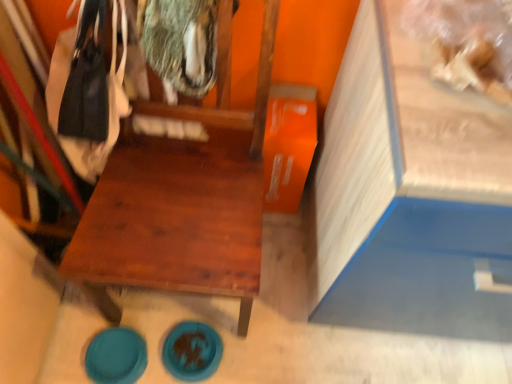
This screenshot has height=384, width=512. Describe the element at coordinates (183, 202) in the screenshot. I see `wooden chair at center` at that location.

The width and height of the screenshot is (512, 384). What are the coordinates of `blue matte plate at lower center, which is counted as the 2th plate, starting from the left` in the screenshot? It's located at click(x=192, y=351).

Can you confirm if blue matte plate at lower center, which is counted as the 2th plate, starting from the left, is positioned to the right of wooden chair at center?

No.

Considering the sizes of objects blue matte plate at lower center, which is counted as the 1th plate, starting from the right, and wooden chair at center in the image provided, who is smaller, blue matte plate at lower center, which is counted as the 1th plate, starting from the right, or wooden chair at center?

With smaller size is blue matte plate at lower center, which is counted as the 1th plate, starting from the right.

Looking at this image, is blue matte plate at lower center, which is counted as the 2th plate, starting from the left, looking in the opposite direction of wooden chair at center?

Yes, blue matte plate at lower center, which is counted as the 2th plate, starting from the left, is positioned with its back facing wooden chair at center.

Could you tell me if wooden chair at center is turned towards teal glossy plate at lower left, which ranks as the 1th plate in left-to-right order?

Yes.

From a real-world perspective, which object stands above the other?

wooden chair at center is physically above.

Based on the photo, is wooden chair at center inside or outside of teal glossy plate at lower left, which ranks as the 1th plate in left-to-right order?

wooden chair at center is not enclosed by teal glossy plate at lower left, which ranks as the 1th plate in left-to-right order.

Is wooden chair at center taller or shorter than teal glossy plate at lower left, which ranks as the 1th plate in left-to-right order?

wooden chair at center is taller than teal glossy plate at lower left, which ranks as the 1th plate in left-to-right order.

From the image's perspective, is teal glossy plate at lower left, marked as the second plate in a right-to-left arrangement, located beneath wooden chair at center?

Yes.

From a real-world perspective, is teal glossy plate at lower left, marked as the second plate in a right-to-left arrangement, physically located above or below wooden chair at center?

Clearly, from a real-world perspective, teal glossy plate at lower left, marked as the second plate in a right-to-left arrangement, is below wooden chair at center.

Is wooden chair at center at the back of teal glossy plate at lower left, marked as the second plate in a right-to-left arrangement?

Yes, teal glossy plate at lower left, marked as the second plate in a right-to-left arrangement, is facing away from wooden chair at center.

Does teal glossy plate at lower left, marked as the second plate in a right-to-left arrangement, have a greater width compared to wooden chair at center?

No, teal glossy plate at lower left, marked as the second plate in a right-to-left arrangement, is not wider than wooden chair at center.

Which object is further away from the camera taking this photo, wooden chair at center or blue matte plate at lower center, which is counted as the 1th plate, starting from the right?

blue matte plate at lower center, which is counted as the 1th plate, starting from the right, is more distant.

Is blue matte plate at lower center, which is counted as the 1th plate, starting from the right, at the back of wooden chair at center?

That's not correct — wooden chair at center is not looking away from blue matte plate at lower center, which is counted as the 1th plate, starting from the right.

Considering the relative sizes of wooden chair at center and blue matte plate at lower center, which is counted as the 1th plate, starting from the right, in the image provided, is wooden chair at center wider than blue matte plate at lower center, which is counted as the 1th plate, starting from the right,?

Indeed, wooden chair at center has a greater width compared to blue matte plate at lower center, which is counted as the 1th plate, starting from the right.

Consider the image. Is teal glossy plate at lower left, marked as the second plate in a right-to-left arrangement, turned away from blue matte plate at lower center, which is counted as the 2th plate, starting from the left?

teal glossy plate at lower left, marked as the second plate in a right-to-left arrangement, is not turned away from blue matte plate at lower center, which is counted as the 2th plate, starting from the left.

Between teal glossy plate at lower left, marked as the second plate in a right-to-left arrangement, and blue matte plate at lower center, which is counted as the 2th plate, starting from the left, which one is positioned in front?

teal glossy plate at lower left, marked as the second plate in a right-to-left arrangement, is in front.

Consider the image. Considering the positions of objects teal glossy plate at lower left, which ranks as the 1th plate in left-to-right order, and blue matte plate at lower center, which is counted as the 2th plate, starting from the left, in the image provided, who is more to the right, teal glossy plate at lower left, which ranks as the 1th plate in left-to-right order, or blue matte plate at lower center, which is counted as the 2th plate, starting from the left,?

blue matte plate at lower center, which is counted as the 2th plate, starting from the left.

Could you tell me if blue matte plate at lower center, which is counted as the 2th plate, starting from the left, is facing teal glossy plate at lower left, which ranks as the 1th plate in left-to-right order?

No.

Considering the relative sizes of blue matte plate at lower center, which is counted as the 2th plate, starting from the left, and teal glossy plate at lower left, marked as the second plate in a right-to-left arrangement, in the image provided, is blue matte plate at lower center, which is counted as the 2th plate, starting from the left, bigger than teal glossy plate at lower left, marked as the second plate in a right-to-left arrangement,?

Correct, blue matte plate at lower center, which is counted as the 2th plate, starting from the left, is larger in size than teal glossy plate at lower left, marked as the second plate in a right-to-left arrangement.

From a real-world perspective, which is physically below, blue matte plate at lower center, which is counted as the 1th plate, starting from the right, or teal glossy plate at lower left, marked as the second plate in a right-to-left arrangement?

In real-world perspective, teal glossy plate at lower left, marked as the second plate in a right-to-left arrangement, is lower.

Between blue matte plate at lower center, which is counted as the 1th plate, starting from the right, and teal glossy plate at lower left, which ranks as the 1th plate in left-to-right order, which one appears on the right side from the viewer's perspective?

blue matte plate at lower center, which is counted as the 1th plate, starting from the right, is more to the right.

In order to click on the 2nd plate behind the wooden chair at center in this screenshot , I will do `click(192, 351)`.

Where is `the 2nd plate to the left of the wooden chair at center, counting from the anchor's position`? the 2nd plate to the left of the wooden chair at center, counting from the anchor's position is located at coordinates point(116,356).

From the picture: Considering their positions, is blue matte plate at lower center, which is counted as the 2th plate, starting from the left, positioned closer to wooden chair at center than teal glossy plate at lower left, marked as the second plate in a right-to-left arrangement?

Among the two, blue matte plate at lower center, which is counted as the 2th plate, starting from the left, is located nearer to wooden chair at center.

Consider the image. When comparing their distances from wooden chair at center, does teal glossy plate at lower left, which ranks as the 1th plate in left-to-right order, or blue matte plate at lower center, which is counted as the 2th plate, starting from the left, seem closer?

Among the two, blue matte plate at lower center, which is counted as the 2th plate, starting from the left, is located nearer to wooden chair at center.

Considering their positions, is wooden chair at center positioned further to teal glossy plate at lower left, which ranks as the 1th plate in left-to-right order, than blue matte plate at lower center, which is counted as the 1th plate, starting from the right?

wooden chair at center is positioned further to the anchor teal glossy plate at lower left, which ranks as the 1th plate in left-to-right order.

Looking at the image, which one is located closer to teal glossy plate at lower left, which ranks as the 1th plate in left-to-right order, blue matte plate at lower center, which is counted as the 2th plate, starting from the left, or wooden chair at center?

Based on the image, blue matte plate at lower center, which is counted as the 2th plate, starting from the left, appears to be nearer to teal glossy plate at lower left, which ranks as the 1th plate in left-to-right order.

From the image, which object appears to be nearer to blue matte plate at lower center, which is counted as the 2th plate, starting from the left, teal glossy plate at lower left, which ranks as the 1th plate in left-to-right order, or wooden chair at center?

Based on the image, teal glossy plate at lower left, which ranks as the 1th plate in left-to-right order, appears to be nearer to blue matte plate at lower center, which is counted as the 2th plate, starting from the left.

Which object lies nearer to the anchor point blue matte plate at lower center, which is counted as the 2th plate, starting from the left, wooden chair at center or teal glossy plate at lower left, which ranks as the 1th plate in left-to-right order?

teal glossy plate at lower left, which ranks as the 1th plate in left-to-right order, lies closer to blue matte plate at lower center, which is counted as the 2th plate, starting from the left, than the other object.

Image resolution: width=512 pixels, height=384 pixels. Identify the location of plate between wooden chair at center and blue matte plate at lower center, which is counted as the 2th plate, starting from the left, in the front-back direction. (116, 356).